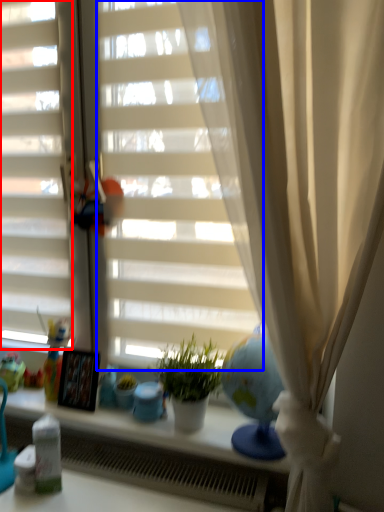
Question: Which object is further to the camera taking this photo, shutter (highlighted by a red box) or blind (highlighted by a blue box)?

Choices:
 (A) shutter
 (B) blind

Answer: (A)